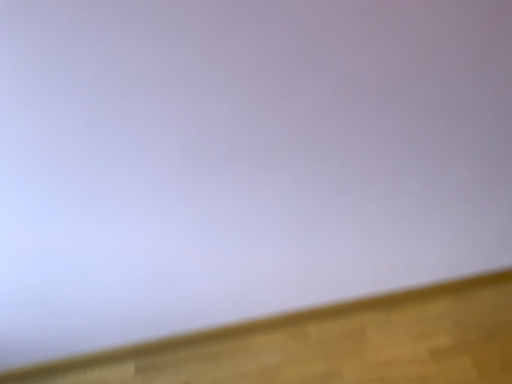
The height and width of the screenshot is (384, 512). What do you see at coordinates (327, 344) in the screenshot? I see `light brown wood at bottom` at bounding box center [327, 344].

The width and height of the screenshot is (512, 384). I want to click on light brown wood at bottom, so click(x=327, y=344).

Where is `light brown wood at bottom`? light brown wood at bottom is located at coordinates click(327, 344).